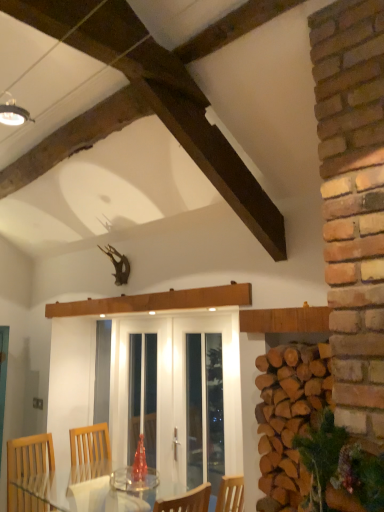
Question: Is the depth of white glass door at center, the first screen door viewed from the right, less than that of natural brown woodpile at right?

Choices:
 (A) yes
 (B) no

Answer: (B)

Question: Does white glass door at center, the first screen door viewed from the right, have a larger size compared to natural brown woodpile at right?

Choices:
 (A) yes
 (B) no

Answer: (B)

Question: Is white glass door at center, the second screen door in the left-to-right sequence, oriented away from natural brown woodpile at right?

Choices:
 (A) yes
 (B) no

Answer: (B)

Question: Is white glass door at center, the first screen door viewed from the right, wider than natural brown woodpile at right?

Choices:
 (A) yes
 (B) no

Answer: (B)

Question: From a real-world perspective, does white glass door at center, the second screen door in the left-to-right sequence, sit lower than natural brown woodpile at right?

Choices:
 (A) yes
 (B) no

Answer: (A)

Question: From a real-world perspective, is white glass door at center, the second screen door in the left-to-right sequence, positioned above or below natural brown woodpile at right?

Choices:
 (A) above
 (B) below

Answer: (B)

Question: Looking at their shapes, would you say white glass door at center, the first screen door viewed from the right, is wider or thinner than natural brown woodpile at right?

Choices:
 (A) wide
 (B) thin

Answer: (B)

Question: Considering their positions, is white glass door at center, the first screen door viewed from the right, located in front of or behind natural brown woodpile at right?

Choices:
 (A) behind
 (B) front

Answer: (A)

Question: From their relative heights in the image, would you say white glass door at center, the first screen door viewed from the right, is taller or shorter than natural brown woodpile at right?

Choices:
 (A) short
 (B) tall

Answer: (B)

Question: Is white glass door at center, the second screen door in the left-to-right sequence, in front of or behind white glass screen door at center, the 1th screen door positioned from the left, in the image?

Choices:
 (A) front
 (B) behind

Answer: (B)

Question: From the image's perspective, relative to white glass screen door at center, the 2th screen door viewed from the right, is white glass door at center, the second screen door in the left-to-right sequence, above or below?

Choices:
 (A) above
 (B) below

Answer: (A)

Question: Considering the positions of point (198, 483) and point (150, 453), is point (198, 483) closer or farther from the camera than point (150, 453)?

Choices:
 (A) closer
 (B) farther

Answer: (B)

Question: Which is correct: white glass door at center, the first screen door viewed from the right, is inside white glass screen door at center, the 1th screen door positioned from the left, or outside of it?

Choices:
 (A) outside
 (B) inside

Answer: (B)

Question: Considering the positions of natural brown woodpile at right and white glass screen door at center, the 1th screen door positioned from the left, in the image, is natural brown woodpile at right wider or thinner than white glass screen door at center, the 1th screen door positioned from the left,?

Choices:
 (A) thin
 (B) wide

Answer: (B)

Question: Based on their sizes in the image, would you say natural brown woodpile at right is bigger or smaller than white glass screen door at center, the 2th screen door viewed from the right?

Choices:
 (A) big
 (B) small

Answer: (B)